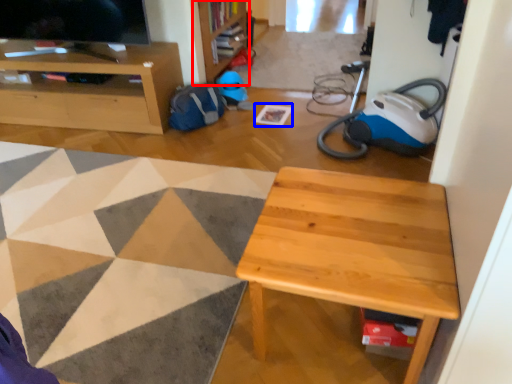
Question: Which of the following is the closest to the observer, bookshelf (highlighted by a red box) or square (highlighted by a blue box)?

Choices:
 (A) bookshelf
 (B) square

Answer: (B)